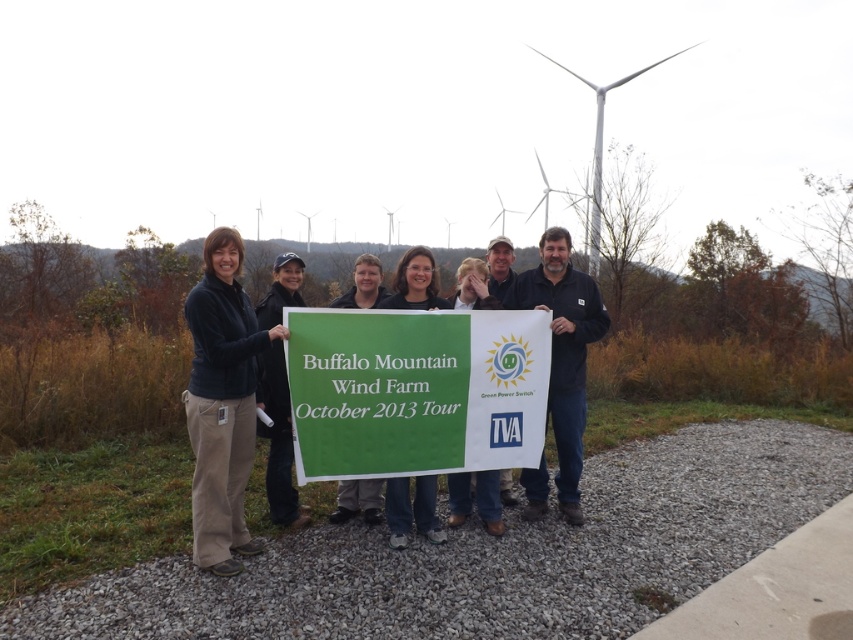
From the picture: How distant is green fabric sign at center from white composite wind turbine at upper center?

14.68 meters

Does green fabric sign at center appear on the left side of white composite wind turbine at upper center?

Correct, you'll find green fabric sign at center to the left of white composite wind turbine at upper center.

Who is more forward, (523, 362) or (595, 88)?

Positioned in front is point (523, 362).

Locate an element on the screen. This screenshot has height=640, width=853. green fabric sign at center is located at coordinates (415, 390).

Which of these two, black fabric shirt at center or matte black shirt at center, stands shorter?

matte black shirt at center

Which of these two, black fabric shirt at center or matte black shirt at center, stands taller?

With more height is black fabric shirt at center.

The height and width of the screenshot is (640, 853). Describe the element at coordinates (563, 349) in the screenshot. I see `black fabric shirt at center` at that location.

Locate an element on the screen. The width and height of the screenshot is (853, 640). black fabric shirt at center is located at coordinates pos(563,349).

Can you confirm if green fabric sign at center is positioned below matte black jacket at center?

No.

Does green fabric sign at center come behind matte black jacket at center?

No, it is not.

You are a GUI agent. You are given a task and a screenshot of the screen. Output one action in this format:
    pyautogui.click(x=<x>, y=<y>)
    Task: Click on the green fabric sign at center
    
    Given the screenshot: What is the action you would take?
    pyautogui.click(x=415, y=390)